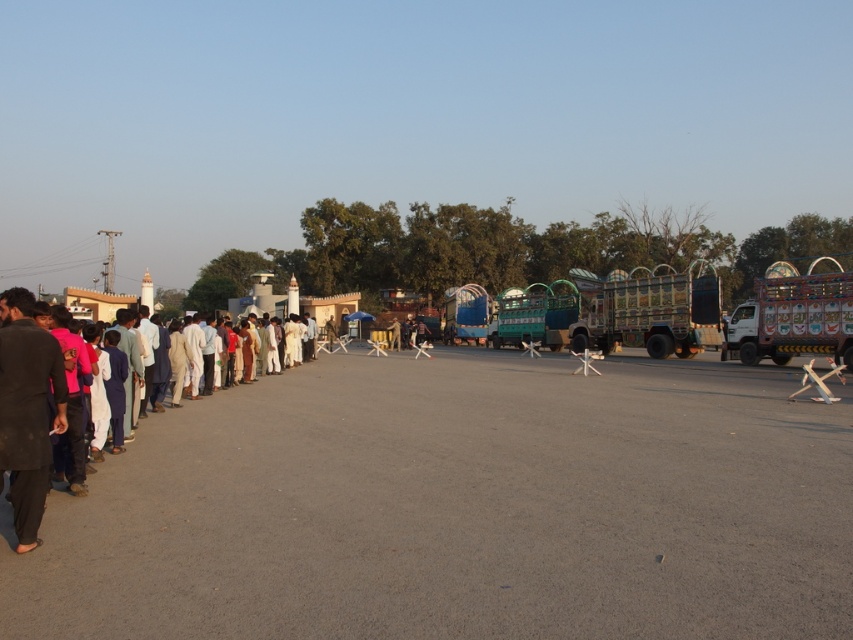
The image size is (853, 640). I want to click on dark brown fabric shirt at left, so click(28, 410).

The height and width of the screenshot is (640, 853). What do you see at coordinates (28, 410) in the screenshot?
I see `dark brown fabric shirt at left` at bounding box center [28, 410].

Identify the location of dark brown fabric shirt at left. (28, 410).